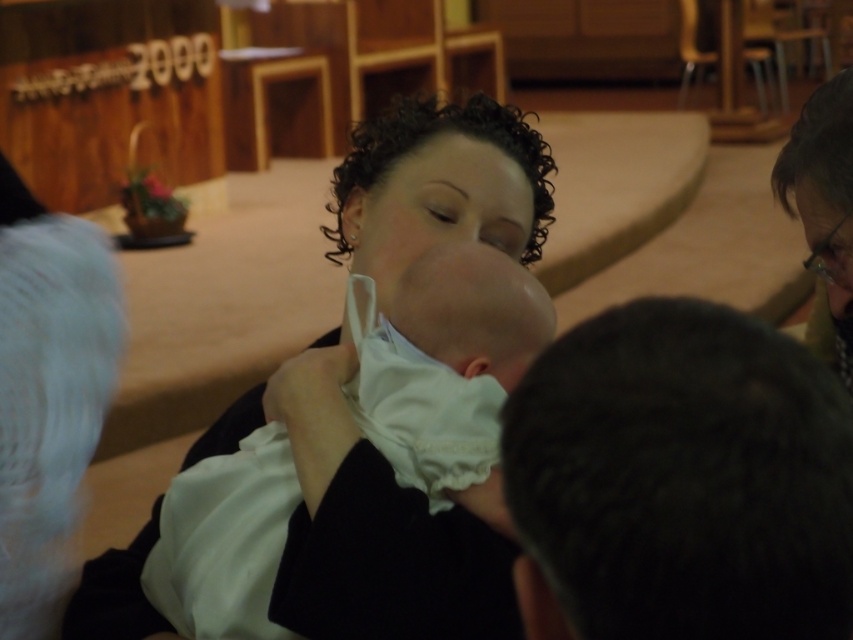
Is dark hair at lower right positioned behind white clothed baby at center?

No, it is not.

The image size is (853, 640). Identify the location of dark hair at lower right. (683, 476).